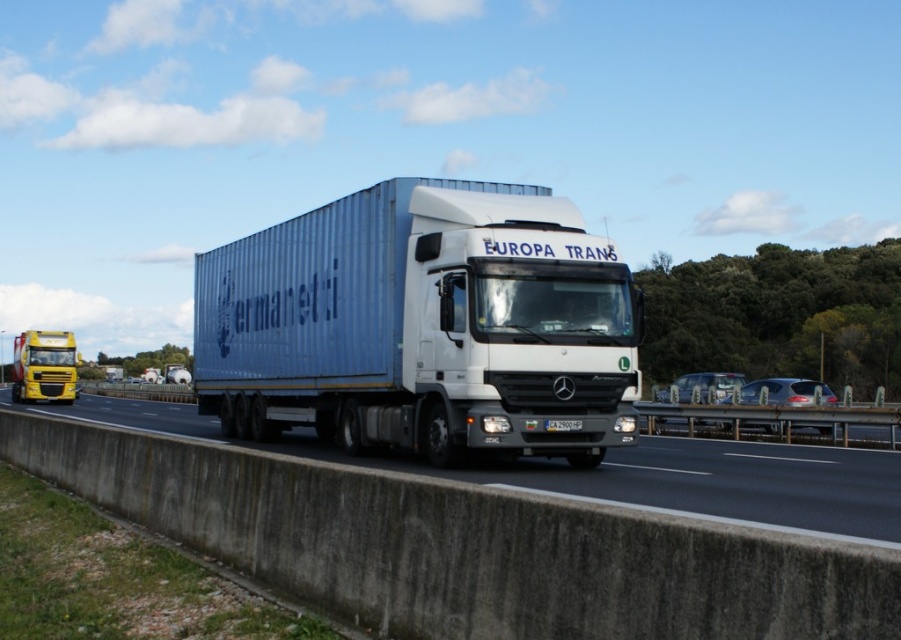
Question: Considering the relative positions of white glossy trailer truck at center and white glossy concrete barrier at lower center in the image provided, where is white glossy trailer truck at center located with respect to white glossy concrete barrier at lower center?

Choices:
 (A) right
 (B) left

Answer: (A)

Question: Can you confirm if white glossy trailer truck at center is wider than metallic yellow truck at left?

Choices:
 (A) yes
 (B) no

Answer: (B)

Question: Among these points, which one is nearest to the camera?

Choices:
 (A) (44, 396)
 (B) (405, 268)
 (C) (210, 435)

Answer: (B)

Question: Is white glossy trailer truck at center positioned behind white glossy concrete barrier at lower center?

Choices:
 (A) no
 (B) yes

Answer: (B)

Question: Which point is closer to the camera taking this photo?

Choices:
 (A) (460, 330)
 (B) (57, 362)
 (C) (854, 474)

Answer: (A)

Question: Considering the real-world distances, which object is farthest from the white glossy concrete barrier at lower center?

Choices:
 (A) metallic yellow truck at left
 (B) white glossy trailer truck at center

Answer: (A)